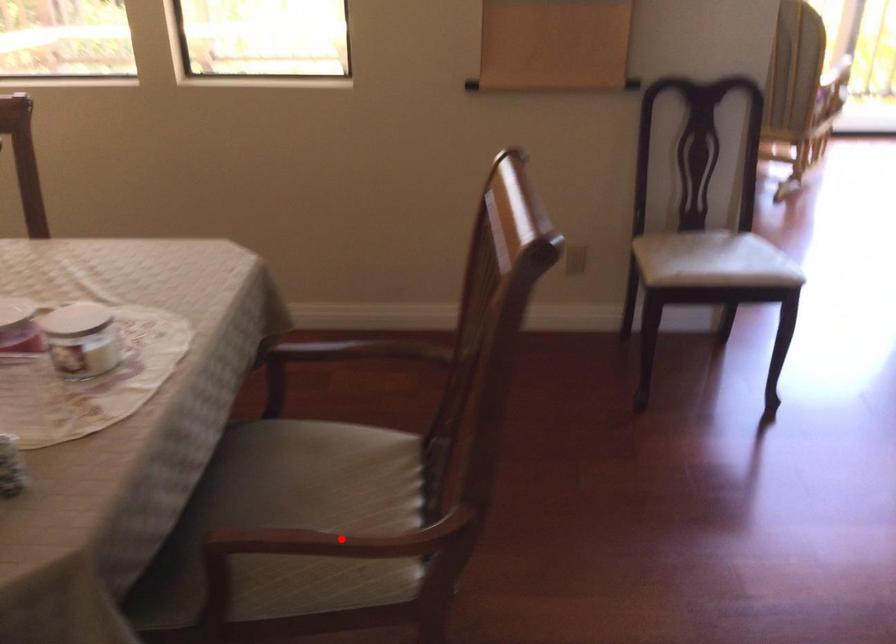
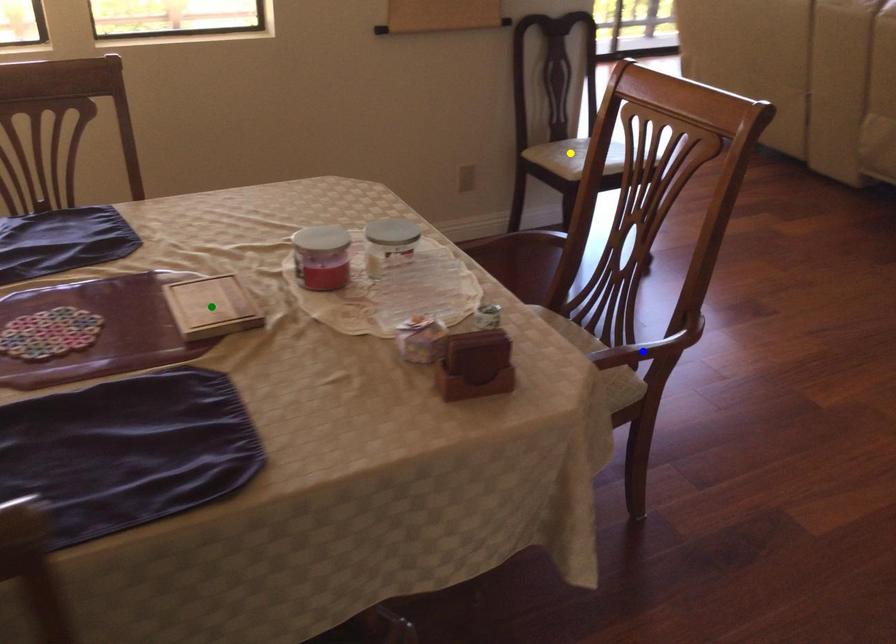
Question: I am providing you with two images of the same scene from different viewpoints. A red point is marked on the first image. You are given multiple points on the second image. Which point in image 2 is actually the same real-world point as the red point in image 1?

Choices:
 (A) green point
 (B) blue point
 (C) yellow point

Answer: (B)